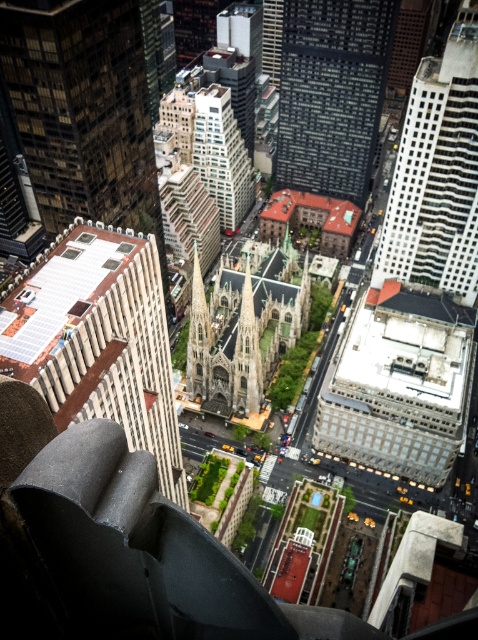
Question: Which of the following is the closest to the observer?

Choices:
 (A) white textured building at right
 (B) stone gothic cathedral at center
 (C) golden stone spire at center

Answer: (A)

Question: Is stone gothic cathedral at center thinner than green stone spire at center?

Choices:
 (A) no
 (B) yes

Answer: (A)

Question: Which of the following is the farthest from the observer?

Choices:
 (A) (160, 406)
 (B) (127, 140)
 (C) (194, 275)

Answer: (C)

Question: Is stone gothic cathedral at center behind white textured building at center?

Choices:
 (A) yes
 (B) no

Answer: (B)

Question: Does stone gothic cathedral at center lie behind green stone spire at center?

Choices:
 (A) yes
 (B) no

Answer: (B)

Question: Which point is closer to the camera taking this photo?

Choices:
 (A) (217, 170)
 (B) (201, 298)
 (C) (186, 369)

Answer: (B)